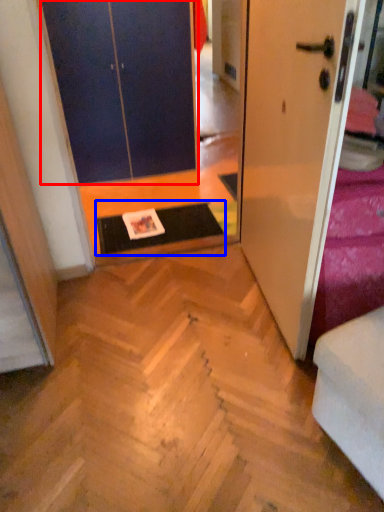
Question: Which object is further to the camera taking this photo, door (highlighted by a red box) or doormat (highlighted by a blue box)?

Choices:
 (A) door
 (B) doormat

Answer: (A)